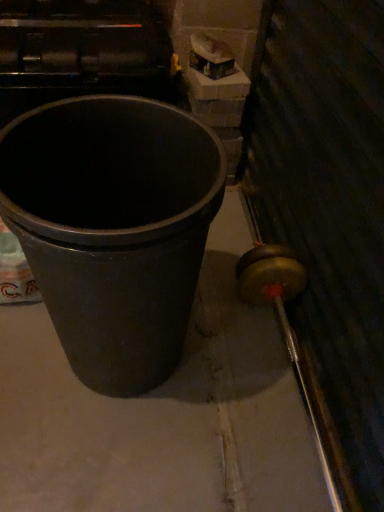
This screenshot has height=512, width=384. I want to click on free space above matte black bucket at center-left (from a real-world perspective), so click(x=184, y=359).